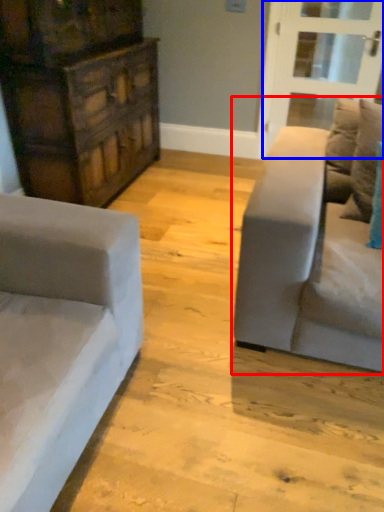
Question: Which point is further to the camera, studio couch (highlighted by a red box) or glass door (highlighted by a blue box)?

Choices:
 (A) studio couch
 (B) glass door

Answer: (B)